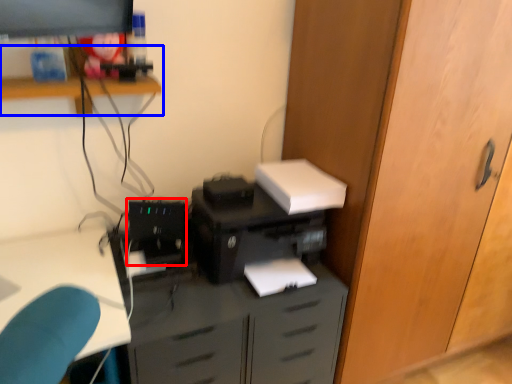
Question: Which point is closer to the camera, computer tower (highlighted by a red box) or shelf (highlighted by a blue box)?

Choices:
 (A) computer tower
 (B) shelf

Answer: (B)